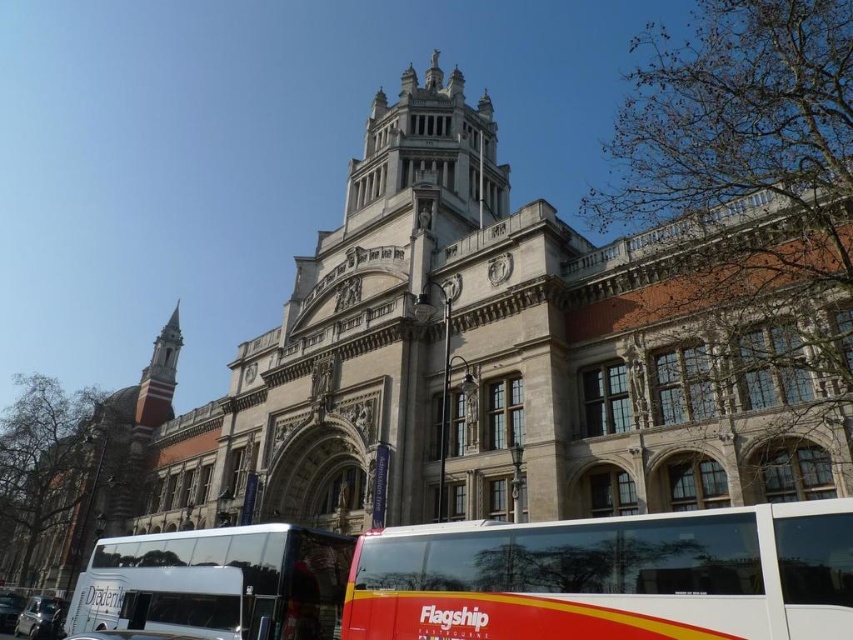
Question: Which of the following is the closest to the observer?

Choices:
 (A) (213, 538)
 (B) (595, 580)

Answer: (B)

Question: Which point is closer to the camera?

Choices:
 (A) (223, 598)
 (B) (532, 579)

Answer: (B)

Question: Is white glossy bus at center closer to the viewer compared to white glossy tour bus at lower left?

Choices:
 (A) yes
 (B) no

Answer: (A)

Question: From the image, what is the correct spatial relationship of white glossy bus at center in relation to white glossy tour bus at lower left?

Choices:
 (A) below
 (B) above

Answer: (B)

Question: Is white glossy bus at center to the left of white glossy tour bus at lower left from the viewer's perspective?

Choices:
 (A) yes
 (B) no

Answer: (B)